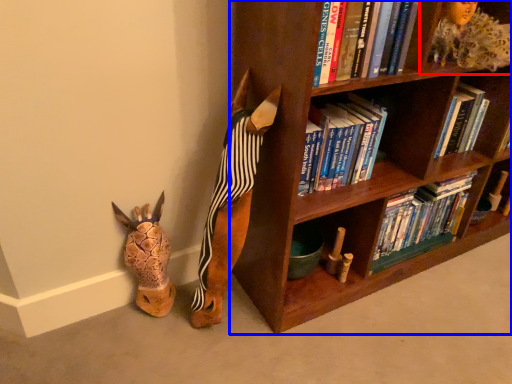
Question: Among these objects, which one is farthest to the camera, shelf (highlighted by a red box) or bookcase (highlighted by a blue box)?

Choices:
 (A) shelf
 (B) bookcase

Answer: (A)